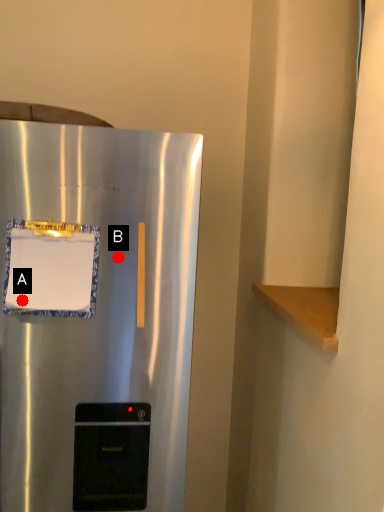
Question: Two points are circled on the image, labeled by A and B beside each circle. Among these points, which one is farthest from the camera?

Choices:
 (A) A is further
 (B) B is further

Answer: (B)